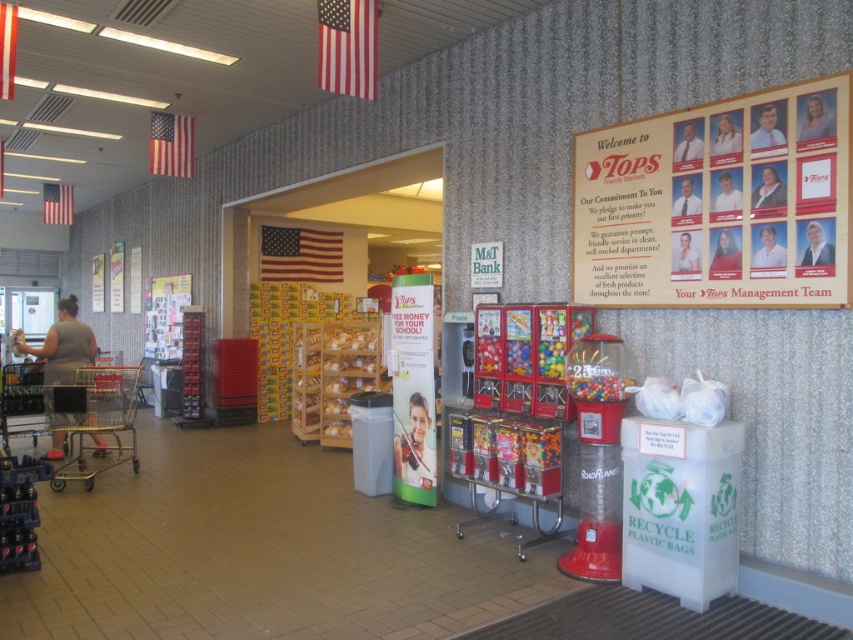
You are a customer entering the Tops Friendly Markets store and see the wooden framed poster at upper right and the gold metallic shopping cart at left. Which object is closer to you?

The wooden framed poster at upper right is closer to you because it is in front of the gold metallic shopping cart at left.